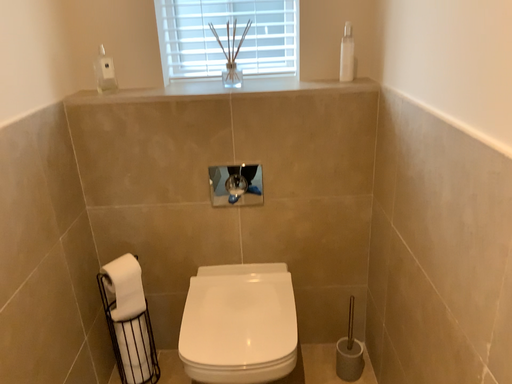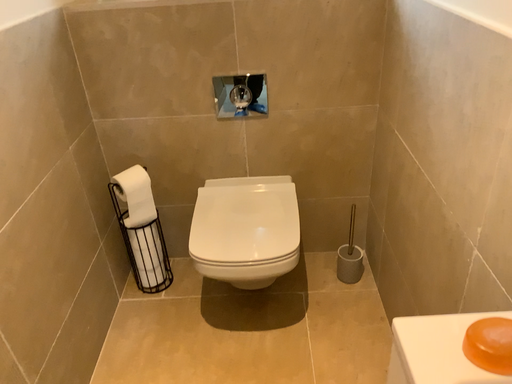
Question: Which way did the camera rotate in the video?

Choices:
 (A) rotated upward
 (B) rotated downward

Answer: (B)